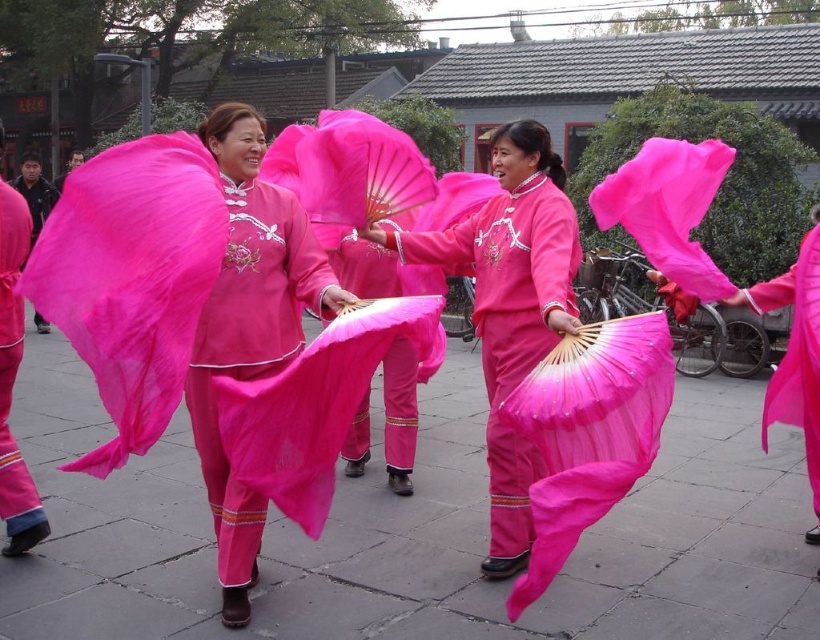
Question: Based on their relative distances, which object is farther from the matte pink fabric pants at lower left?

Choices:
 (A) matte pink silk fan at center
 (B) matte pink fabric at center
 (C) matte pink robe at center

Answer: (C)

Question: Does matte pink silk fan at center have a lesser width compared to matte pink fabric pants at lower left?

Choices:
 (A) yes
 (B) no

Answer: (B)

Question: Based on their relative distances, which object is farther from the matte pink fabric at center?

Choices:
 (A) matte pink fabric pants at lower left
 (B) matte pink silk fan at center

Answer: (A)

Question: Which of the following is the farthest from the observer?

Choices:
 (A) (764, 429)
 (B) (126, 332)
 (C) (479, 236)

Answer: (C)

Question: Can you confirm if matte pink silk fan at center is positioned to the left of matte pink fabric pants at lower left?

Choices:
 (A) yes
 (B) no

Answer: (B)

Question: Does matte pink silk fan at center have a larger size compared to matte pink robe at center?

Choices:
 (A) yes
 (B) no

Answer: (A)